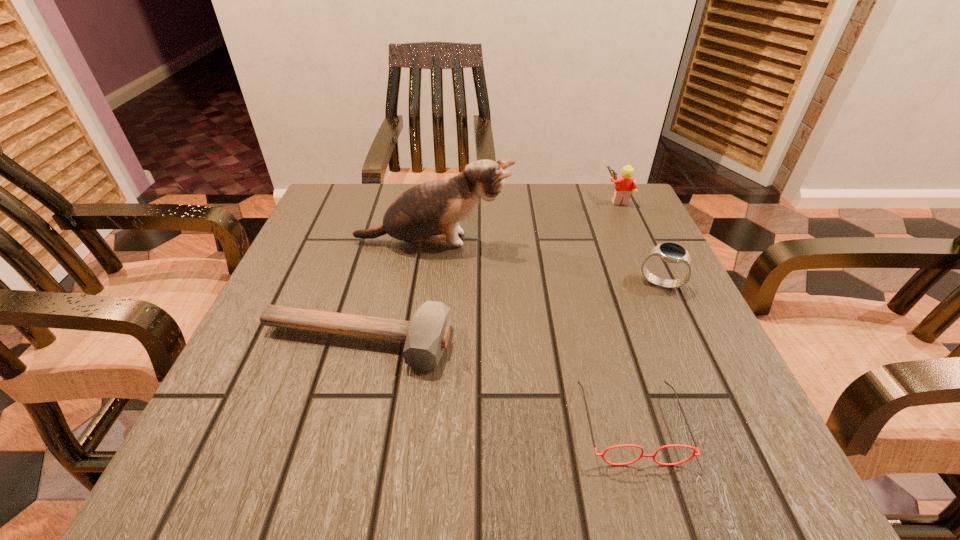
This screenshot has height=540, width=960. What are the coordinates of `the tallest object` in the screenshot? It's located at (430, 212).

The height and width of the screenshot is (540, 960). In order to click on the second farthest object in this screenshot , I will do `click(430, 212)`.

You are a GUI agent. You are given a task and a screenshot of the screen. Output one action in this format:
    pyautogui.click(x=<x>, y=<y>)
    Task: Click on the farthest object
    
    Given the screenshot: What is the action you would take?
    pyautogui.click(x=625, y=184)

Locate an element on the screen. the fourth shortest object is located at coordinates (625, 184).

Identify the location of watch. The height and width of the screenshot is (540, 960). (670, 252).

The height and width of the screenshot is (540, 960). I want to click on the third nearest object, so click(670, 252).

What are the coordinates of `mallet` in the screenshot? It's located at (425, 337).

This screenshot has height=540, width=960. I want to click on the third object from left to right, so click(627, 445).

Where is `the nearest object`? the nearest object is located at coordinates (627, 445).

You are a GUI agent. You are given a task and a screenshot of the screen. Output one action in this format:
    pyautogui.click(x=<x>, y=<y>)
    Task: Click on the free space located at the face of the fourth nearest object
    The image size is (960, 540).
    Given the screenshot: What is the action you would take?
    pyautogui.click(x=566, y=241)